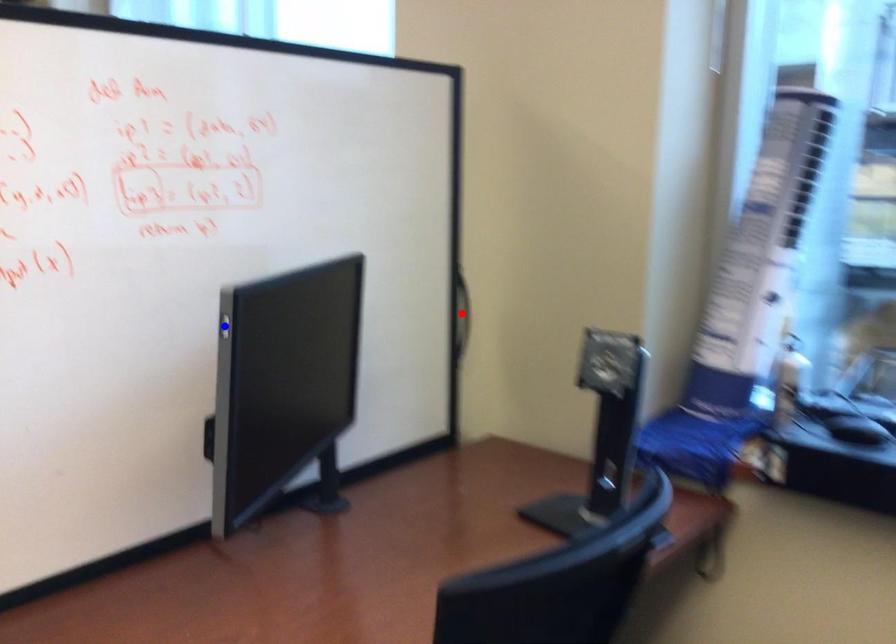
Question: Which of the two points in the image is closer to the camera?

Choices:
 (A) Blue point is closer.
 (B) Red point is closer.

Answer: (A)